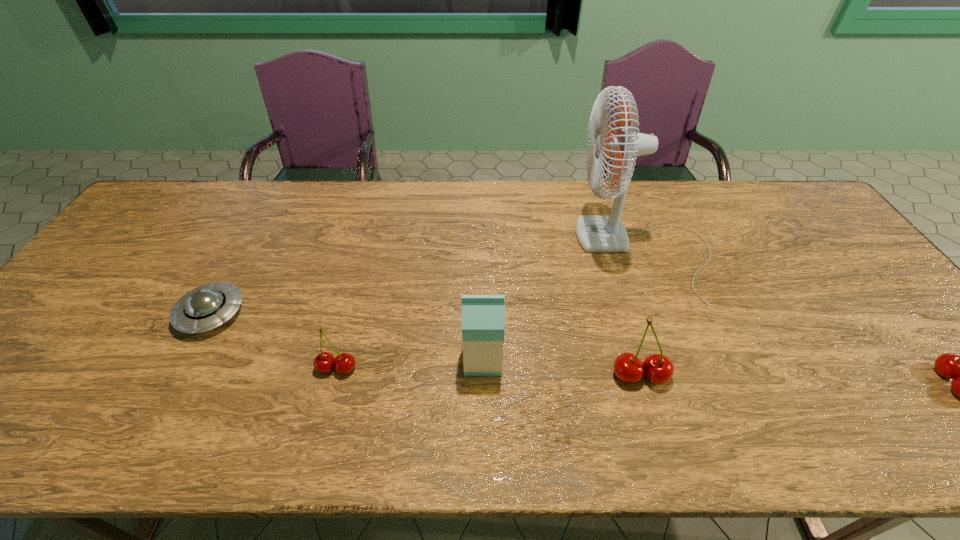
Where is `the second object from left to right`? The image size is (960, 540). the second object from left to right is located at coordinates (324, 362).

The width and height of the screenshot is (960, 540). I want to click on the leftmost cherry, so click(324, 362).

Where is `the second cherry from left to right`? the second cherry from left to right is located at coordinates (659, 369).

What are the coordinates of `the tallest object` in the screenshot? It's located at (596, 233).

The height and width of the screenshot is (540, 960). Find the location of `saucer`. saucer is located at coordinates (206, 307).

Image resolution: width=960 pixels, height=540 pixels. I want to click on the leftmost object, so click(x=206, y=307).

Find the location of a particular element. the second tallest object is located at coordinates 483,316.

Locate an element on the screen. milk carton is located at coordinates (483, 316).

At what (x,y) coordinates should I click in order to perform the action: click on free location located on the front-facing side of the tallest object. Please return your answer as a coordinate pair (x, y). The image size is (960, 540). Looking at the image, I should click on click(498, 252).

Where is `free space located on the front-facing side of the tallest object`? The image size is (960, 540). free space located on the front-facing side of the tallest object is located at coordinates (474, 252).